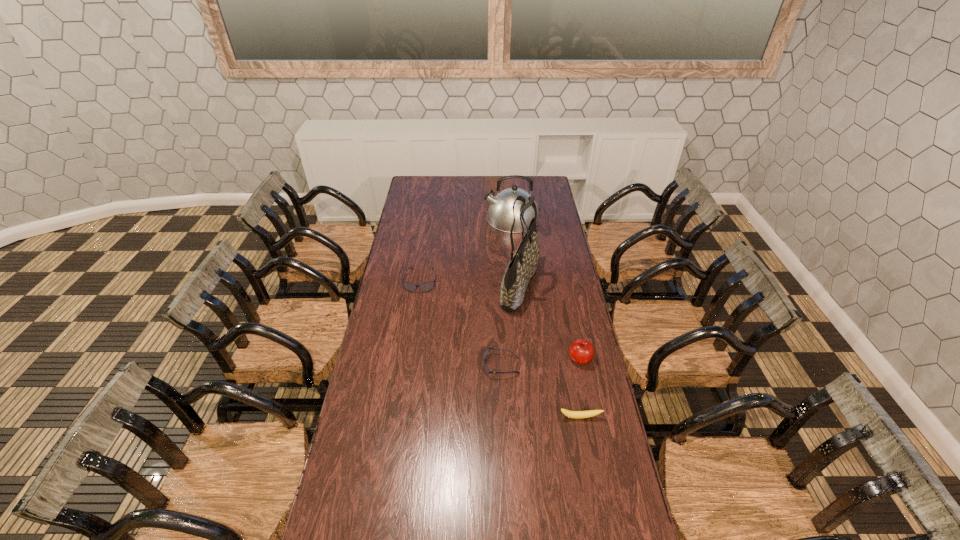
Locate an element on the screen. The height and width of the screenshot is (540, 960). blank area located 0.150m on the lenses of the shorter sunglasses is located at coordinates (444, 365).

You are a GUI agent. You are given a task and a screenshot of the screen. Output one action in this format:
    pyautogui.click(x=<x>, y=<y>)
    Task: Click on the free point located 0.370m on the lenses of the shorter sunglasses
    This screenshot has height=540, width=960.
    Given the screenshot: What is the action you would take?
    pyautogui.click(x=388, y=365)

Identify the location of vacant space located 0.320m on the lenses of the shorter sunglasses. The image size is (960, 540). (401, 365).

Locate an element on the screen. Image resolution: width=960 pixels, height=540 pixels. vacant space located from the spout of the fifth shortest object is located at coordinates click(x=470, y=218).

Identify the location of blank space located 0.130m from the spout of the fifth shortest object. The image size is (960, 540). (461, 218).

Identify the location of vacant space located from the spout of the fifth shortest object. (473, 218).

Where is `vacant space located on the back of the third tallest object`? This screenshot has width=960, height=540. vacant space located on the back of the third tallest object is located at coordinates (564, 288).

Locate an element on the screen. Image resolution: width=960 pixels, height=540 pixels. vacant area situated 0.090m on the right of the tote bag is located at coordinates (560, 286).

The height and width of the screenshot is (540, 960). Find the location of `vacant point located on the upward curve of the banana`. vacant point located on the upward curve of the banana is located at coordinates (596, 501).

Locate an element on the screen. object located at the left edge is located at coordinates (425, 287).